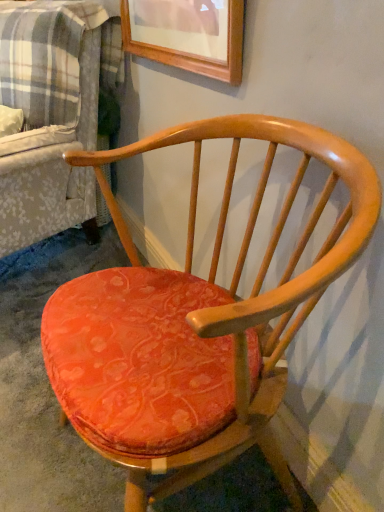
Question: Is matte orange cushioned chair at center at the left side of plaid fabric couch at left?

Choices:
 (A) yes
 (B) no

Answer: (B)

Question: Can plaid fabric couch at left be found inside matte orange cushioned chair at center?

Choices:
 (A) no
 (B) yes

Answer: (A)

Question: From a real-world perspective, is matte orange cushioned chair at center located beneath plaid fabric couch at left?

Choices:
 (A) no
 (B) yes

Answer: (B)

Question: Does matte orange cushioned chair at center touch plaid fabric couch at left?

Choices:
 (A) no
 (B) yes

Answer: (A)

Question: Is matte orange cushioned chair at center positioned behind plaid fabric couch at left?

Choices:
 (A) yes
 (B) no

Answer: (B)

Question: Considering the relative sizes of matte orange cushioned chair at center and plaid fabric couch at left in the image provided, is matte orange cushioned chair at center shorter than plaid fabric couch at left?

Choices:
 (A) no
 (B) yes

Answer: (B)

Question: Does velvet orange cushion at center have a smaller size compared to plaid fabric couch at left?

Choices:
 (A) yes
 (B) no

Answer: (A)

Question: From a real-world perspective, is velvet orange cushion at center under plaid fabric couch at left?

Choices:
 (A) yes
 (B) no

Answer: (A)

Question: Could plaid fabric couch at left be considered to be inside velvet orange cushion at center?

Choices:
 (A) yes
 (B) no

Answer: (B)

Question: Is velvet orange cushion at center far from plaid fabric couch at left?

Choices:
 (A) no
 (B) yes

Answer: (A)

Question: Can you confirm if velvet orange cushion at center is bigger than plaid fabric couch at left?

Choices:
 (A) no
 (B) yes

Answer: (A)

Question: Is velvet orange cushion at center in contact with plaid fabric couch at left?

Choices:
 (A) yes
 (B) no

Answer: (B)

Question: From a real-world perspective, is plaid fabric couch at left positioned over velvet orange cushion at center based on gravity?

Choices:
 (A) yes
 (B) no

Answer: (A)